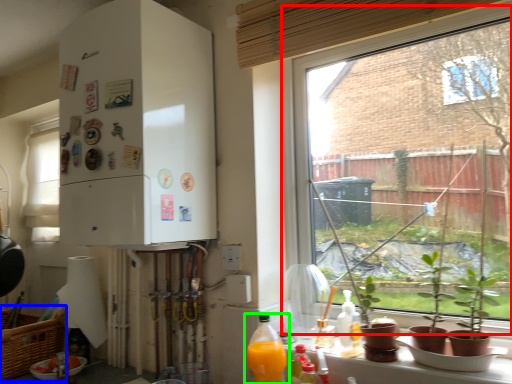
Question: Estimate the real-world distances between objects in this image. Which object is closer to window (highlighted by a red box), picnic basket (highlighted by a blue box) or bottle (highlighted by a green box)?

Choices:
 (A) picnic basket
 (B) bottle

Answer: (B)